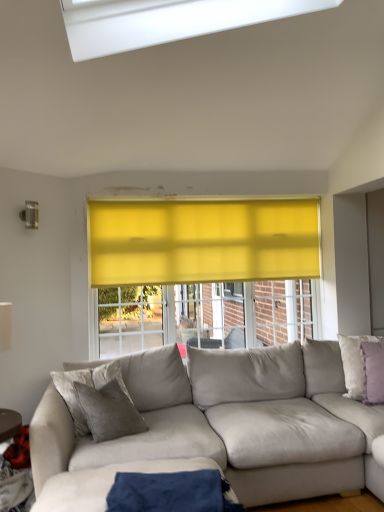
Question: Considering their positions, is purple velvet pillow at right, the 1th pillow viewed from the front, located in front of or behind wooden textured table at lower left?

Choices:
 (A) front
 (B) behind

Answer: (B)

Question: Looking at their shapes, would you say purple velvet pillow at right, the 1th pillow viewed from the front, is wider or thinner than wooden textured table at lower left?

Choices:
 (A) wide
 (B) thin

Answer: (B)

Question: Which of these objects is positioned farthest from the wooden textured table at lower left?

Choices:
 (A) blue fabric at lower center
 (B) purple velvet pillow at right, which is counted as the 2th pillow, starting from the back
 (C) purple velvet pillow at right, which ranks as the 2th pillow in front-to-back order
 (D) suede beige couch at lower right
 (E) white matte table lamp at left

Answer: (C)

Question: Estimate the real-world distances between objects in this image. Which object is farther from the wooden textured table at lower left?

Choices:
 (A) purple velvet pillow at right, the 1th pillow positioned from the back
 (B) suede beige couch at lower right
 (C) white matte table lamp at left
 (D) purple velvet pillow at right, the 1th pillow viewed from the front
 (E) blue fabric at lower center

Answer: (A)